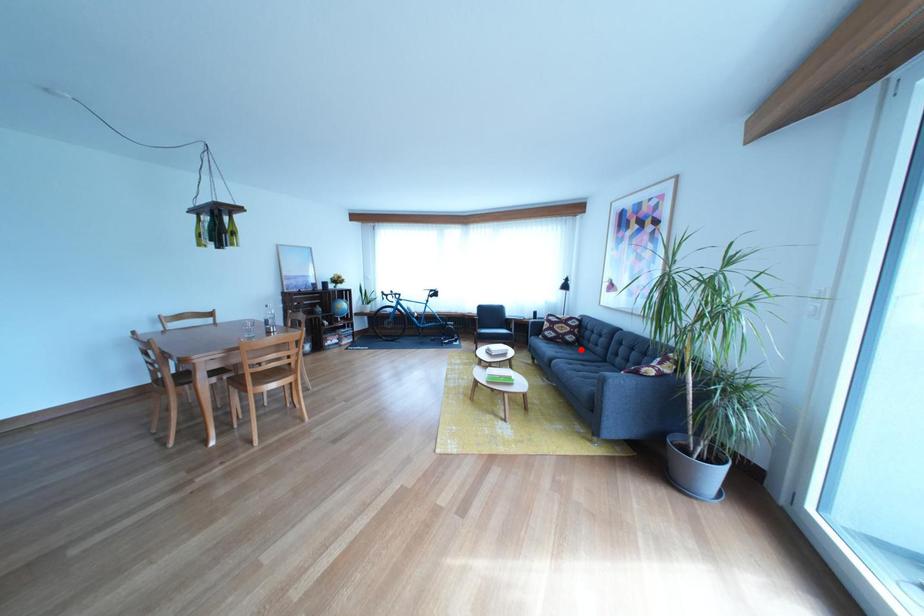
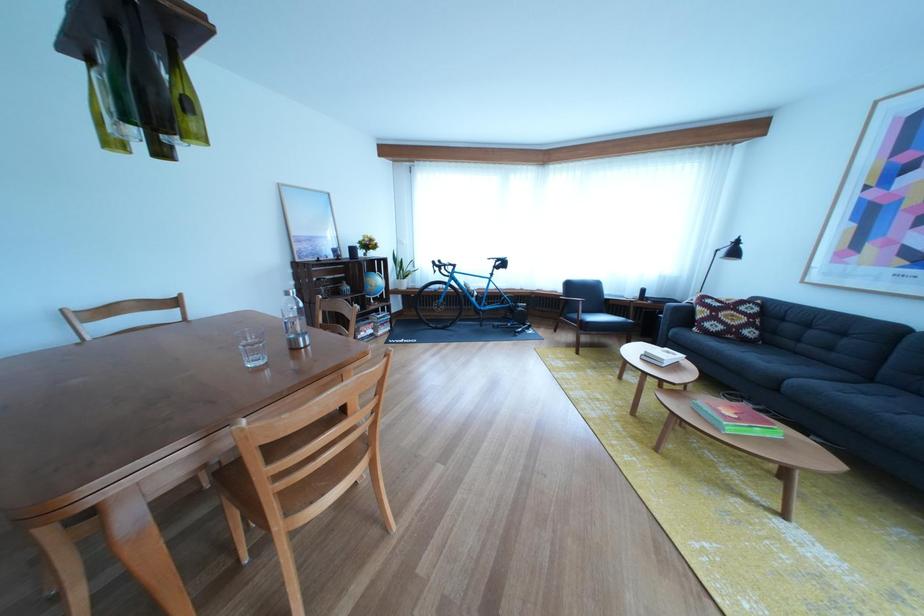
The point at the highlighted location is marked in the first image. Where is the corresponding point in the second image?

(758, 347)